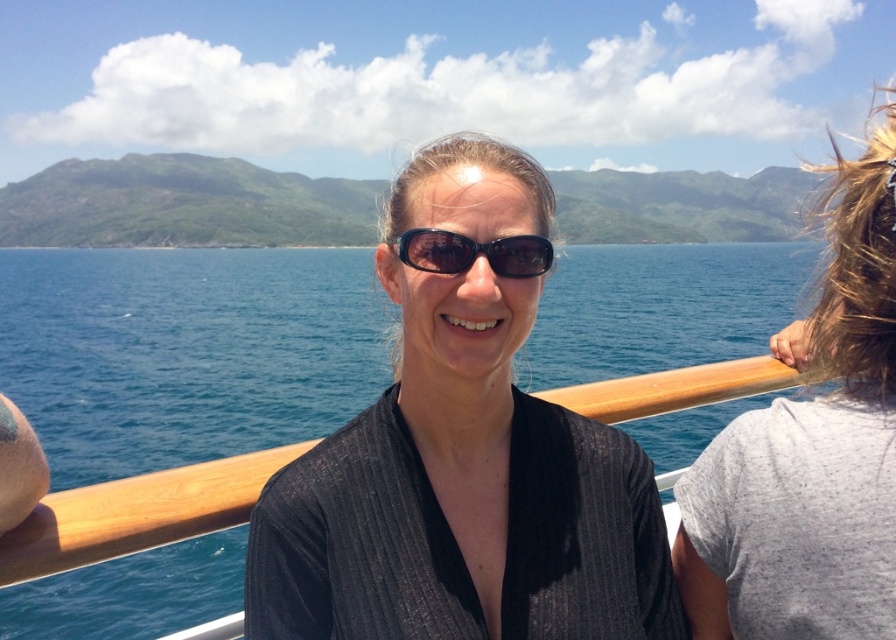
You are a photographer trying to capture the woman on the boat. You want to ensure that both the black ribbed shirt at center and the sunglasses at center are clearly visible in the photo. Given that your camera has a minimum focus distance of 20 inches, will you be able to focus on both objects simultaneously?

The black ribbed shirt at center and sunglasses at center are 21.50 inches apart from each other. Since the distance between them exceeds the camera minimum focus distance of 20 inches, the camera can focus on both objects simultaneously.

You are a photographer standing on the deck of a boat. You want to take a photo of the black ribbed shirt at center. If your camera has a maximum focus range of 4 meters, will you need to adjust your position to capture the subject clearly?

The black ribbed shirt at center is 4.46 meters away from the camera. Since the camera can only focus up to 4 meters, you need to move closer to the black ribbed shirt at center to ensure it is in focus.

You are on a boat and want to take a photo of the blue water at center and the black ribbed shirt at center. Which object should you focus on first if you want to capture both in the same frame without moving the camera?

The blue water at center is located above the black ribbed shirt at center, so you should focus on the black ribbed shirt at center first to ensure both are in focus since it is closer to the camera.